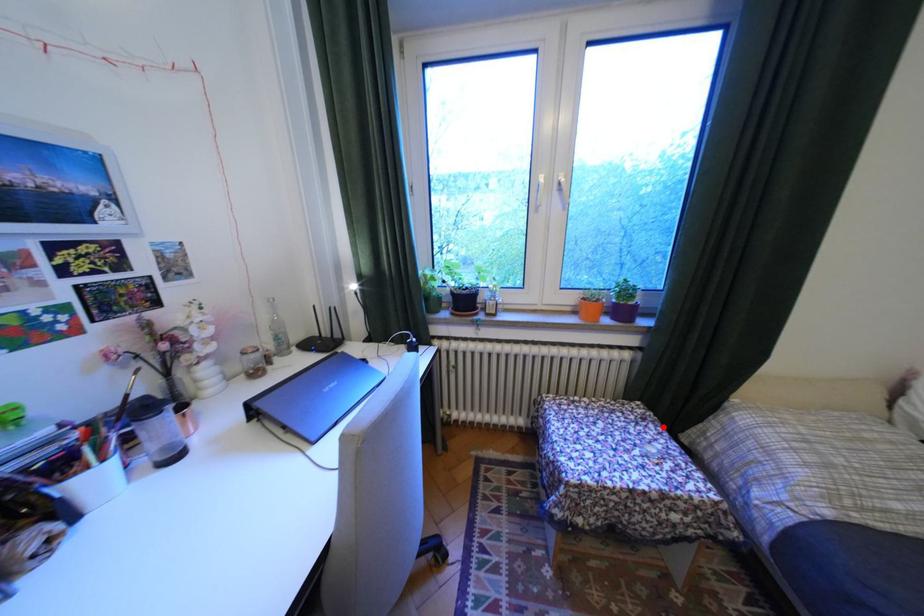
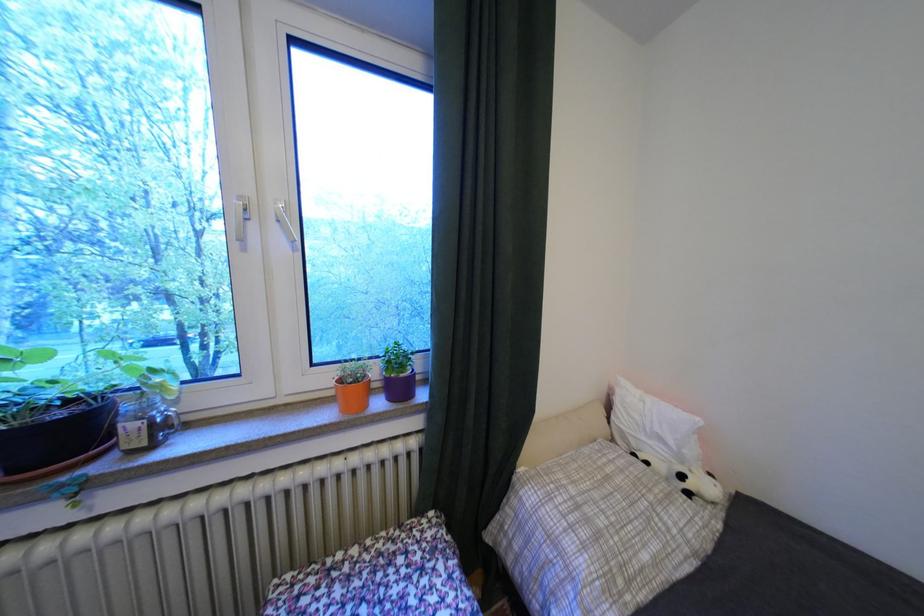
Locate, in the second image, the point that corresponds to the highlighted location in the first image.

(453, 565)